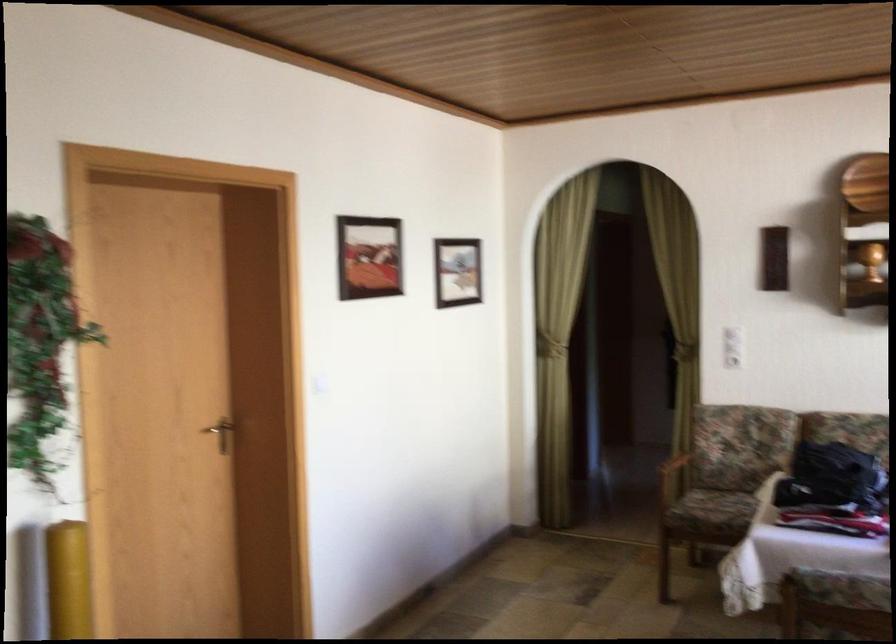
The width and height of the screenshot is (896, 644). What do you see at coordinates (725, 507) in the screenshot?
I see `a chair sitting surface` at bounding box center [725, 507].